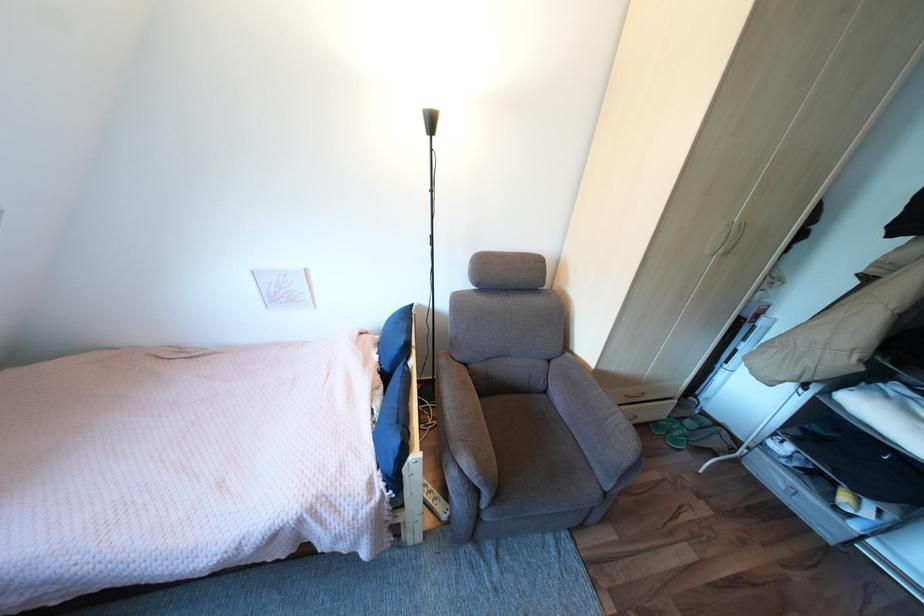
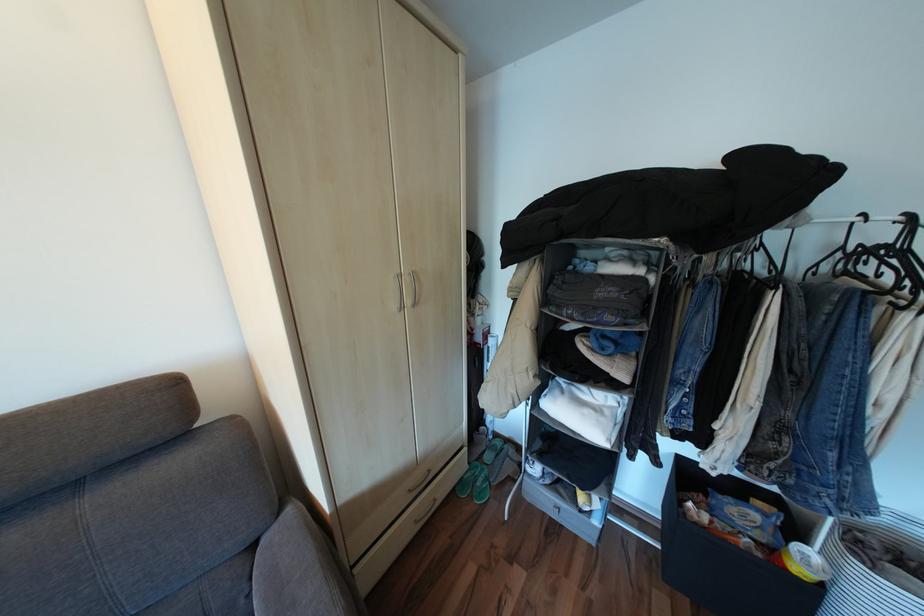
In the second image, find the point that corresponds to the point at 686,400 in the first image.

(477, 448)